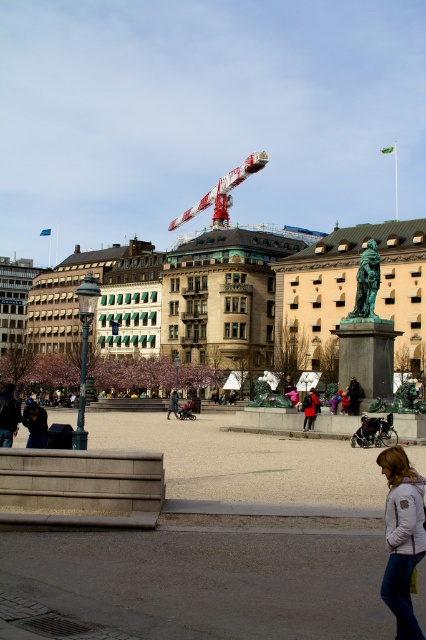
Which is above, dark brown leather jacket at center or dark gray coat at center?

Positioned higher is dark brown leather jacket at center.

The height and width of the screenshot is (640, 426). What do you see at coordinates (353, 394) in the screenshot?
I see `dark brown leather jacket at center` at bounding box center [353, 394].

Does point (354, 388) come behind point (169, 401)?

No, (354, 388) is in front of (169, 401).

Locate an element on the screen. dark brown leather jacket at center is located at coordinates (353, 394).

Based on the photo, how much distance is there between smooth concrete bench at lower left and green bronze statue at center?

The distance of smooth concrete bench at lower left from green bronze statue at center is 21.38 meters.

Is smooth concrete bench at lower left positioned before green bronze statue at center?

Yes.

Who is more distant from viewer, (158,419) or (377,317)?

Positioned behind is point (158,419).

The image size is (426, 640). In order to click on smooth concrete bench at lower left in this screenshot , I will do `click(221, 540)`.

Looking at this image, which of these two, smooth concrete bench at lower left or white painted metal crane at upper center, stands taller?

Standing taller between the two is white painted metal crane at upper center.

Is point (368, 611) positioned before point (253, 150)?

Yes, it is in front of point (253, 150).

Locate an element on the screen. This screenshot has height=640, width=426. smooth concrete bench at lower left is located at coordinates (221, 540).

Find the location of a particular element. This screenshot has height=640, width=426. smooth concrete bench at lower left is located at coordinates (221, 540).